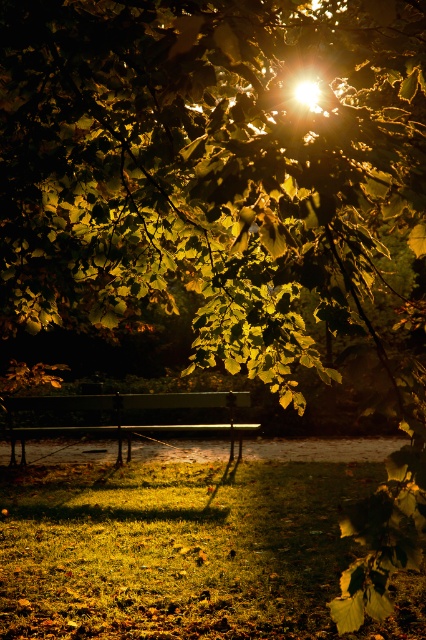
Which is behind, point (22, 461) or point (304, 88)?

Point (22, 461)

Does green matte bench at center have a smaller size compared to matte glass light at upper center?

No, green matte bench at center is not smaller than matte glass light at upper center.

Between point (204, 396) and point (316, 104), which one is positioned in front?

Positioned in front is point (316, 104).

Image resolution: width=426 pixels, height=640 pixels. In order to click on green matte bench at center in this screenshot , I will do pyautogui.click(x=127, y=408).